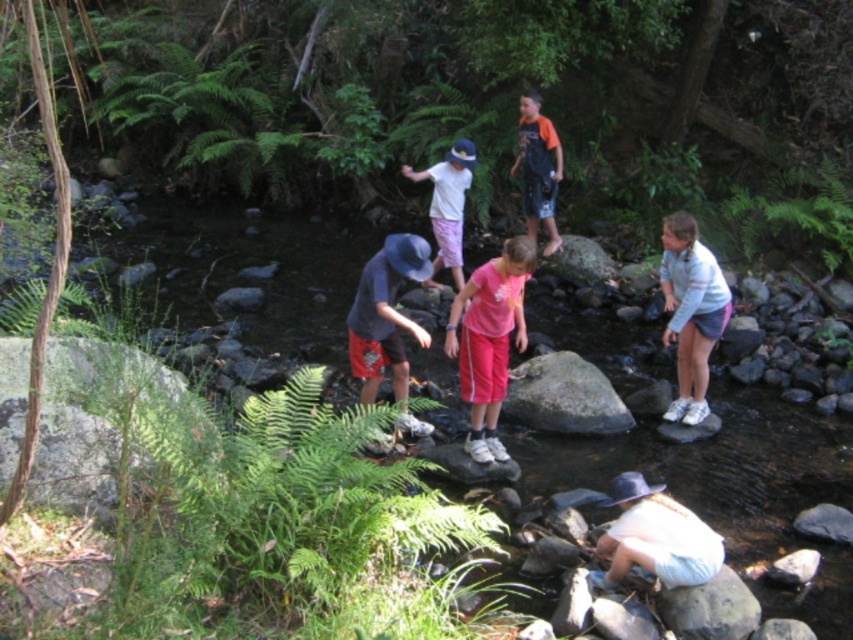
Question: Estimate the real-world distances between objects in this image. Which object is farther from the pink fabric pants at center?

Choices:
 (A) white cotton hat at center
 (B) smooth gray rock at center
 (C) white matte hat at center

Answer: (C)

Question: Is the position of white cotton shirt at center more distant than that of orange cotton shirt at center?

Choices:
 (A) no
 (B) yes

Answer: (A)

Question: Can you confirm if pink fabric pants at center is positioned to the right of smooth gray rock at lower center?

Choices:
 (A) yes
 (B) no

Answer: (B)

Question: Does smooth rock creek at center come behind pink fabric pants at center?

Choices:
 (A) yes
 (B) no

Answer: (B)

Question: Which object is the farthest from the gray smooth rock at center?

Choices:
 (A) smooth rock creek at center
 (B) white matte hat at center
 (C) smooth gray rock at lower center
 (D) orange cotton shirt at center

Answer: (D)

Question: Which object is the closest to the gray smooth rock at center?

Choices:
 (A) smooth rock creek at center
 (B) smooth gray rock at center
 (C) white matte hat at center
 (D) white cotton shirt at center

Answer: (D)